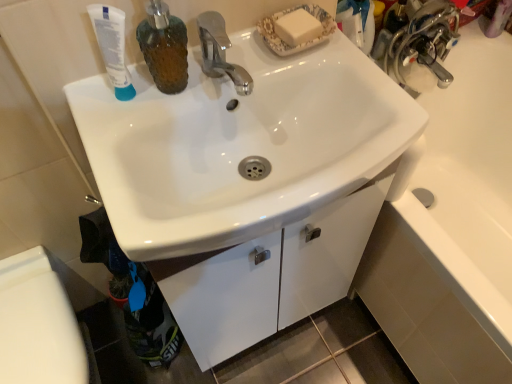
Question: Considering the positions of white matte tube at upper left and white glossy toilet bowl at lower left in the image, is white matte tube at upper left wider or thinner than white glossy toilet bowl at lower left?

Choices:
 (A) wide
 (B) thin

Answer: (B)

Question: Looking at the image, does white matte tube at upper left seem bigger or smaller compared to white glossy toilet bowl at lower left?

Choices:
 (A) small
 (B) big

Answer: (A)

Question: Based on their relative distances, which object is farther from the white glossy toilet bowl at lower left?

Choices:
 (A) white glossy sink at center
 (B) brown textured soap dispenser at upper left
 (C) white glossy cabinet at lower center
 (D) white matte tube at upper left

Answer: (B)

Question: Estimate the real-world distances between objects in this image. Which object is farther from the white glossy toilet bowl at lower left?

Choices:
 (A) white glossy sink at center
 (B) brown textured soap dispenser at upper left
 (C) white glossy cabinet at lower center
 (D) white matte tube at upper left

Answer: (B)